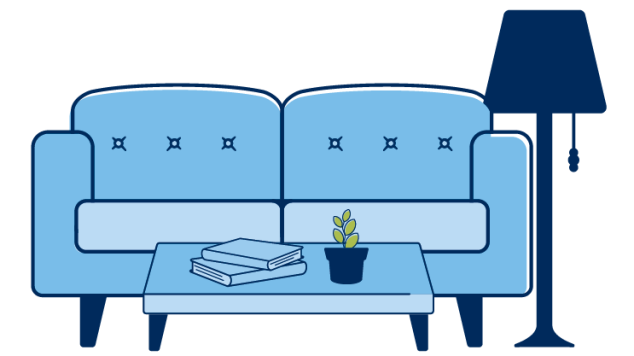
You are a GUI agent. You are given a task and a screenshot of the screen. Output one action in this format:
    pyautogui.click(x=<x>, y=<y>)
    Task: Click on the table
    
    Given the screenshot: What is the action you would take?
    pyautogui.click(x=204, y=306)